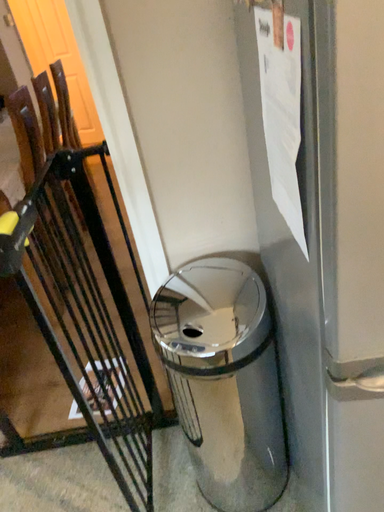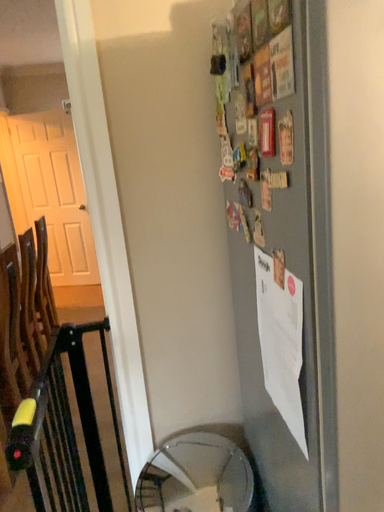
Question: How did the camera likely rotate when shooting the video?

Choices:
 (A) rotated upward
 (B) rotated downward

Answer: (A)